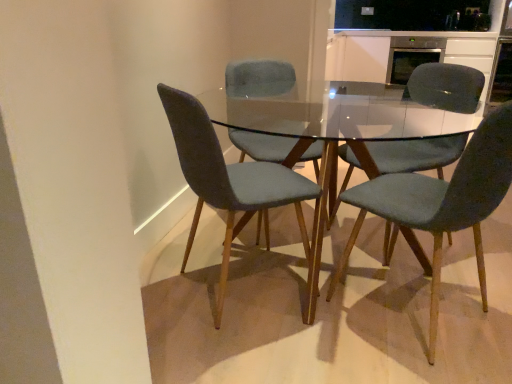
Question: From their relative heights in the image, would you say velvet teal chair at center, which ranks as the 1th chair in right-to-left order, is taller or shorter than stainless steel oven at upper right?

Choices:
 (A) short
 (B) tall

Answer: (B)

Question: Considering the positions of velvet teal chair at center, which ranks as the 1th chair in right-to-left order, and stainless steel oven at upper right in the image, is velvet teal chair at center, which ranks as the 1th chair in right-to-left order, wider or thinner than stainless steel oven at upper right?

Choices:
 (A) thin
 (B) wide

Answer: (A)

Question: Based on their relative distances, which object is nearer to the transparent glass table at center?

Choices:
 (A) stainless steel oven at upper right
 (B) velvet teal chair at center, placed as the third chair when sorted from left to right
 (C) velvet grey chair at center, the 1th chair in the left-to-right sequence
 (D) velvet teal chair at center, which ranks as the 1th chair in right-to-left order
 (E) velvet grey chair at center, placed as the 3th chair when sorted from right to left

Answer: (C)

Question: Estimate the real-world distances between objects in this image. Which object is farther from the velvet teal chair at center, which is counted as the 2th chair, starting from the right?

Choices:
 (A) velvet grey chair at center, placed as the 3th chair when sorted from right to left
 (B) transparent glass table at center
 (C) satin white cabinet at upper right
 (D) velvet grey chair at center, positioned as the 4th chair in right-to-left order
 (E) stainless steel oven at upper right

Answer: (C)